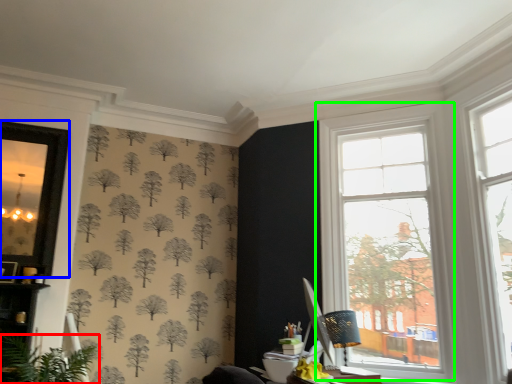
Question: Which object is positioned closest to houseplant (highlighted by a red box)? Select from window screen (highlighted by a blue box) and window (highlighted by a green box).

Choices:
 (A) window screen
 (B) window

Answer: (A)